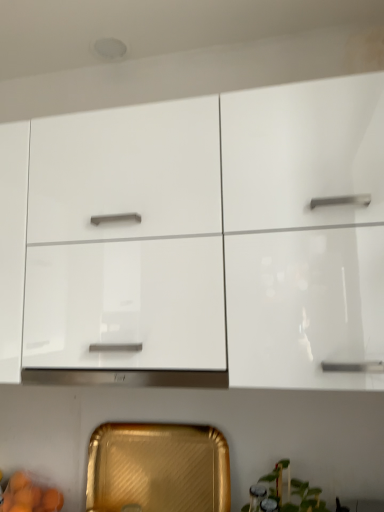
Question: From a real-world perspective, is gold textured tray at lower center, which is the first cabinetry in bottom-to-top order, beneath white glossy cabinet at upper center, placed as the 2th cabinetry when sorted from bottom to top?

Choices:
 (A) no
 (B) yes

Answer: (B)

Question: Considering the relative sizes of gold textured tray at lower center, marked as the second cabinetry in a top-to-bottom arrangement, and white glossy cabinet at upper center, which ranks as the 1th cabinetry in top-to-bottom order, in the image provided, is gold textured tray at lower center, marked as the second cabinetry in a top-to-bottom arrangement, smaller than white glossy cabinet at upper center, which ranks as the 1th cabinetry in top-to-bottom order,?

Choices:
 (A) no
 (B) yes

Answer: (B)

Question: Can you confirm if gold textured tray at lower center, marked as the second cabinetry in a top-to-bottom arrangement, is shorter than white glossy cabinet at upper center, placed as the 2th cabinetry when sorted from bottom to top?

Choices:
 (A) yes
 (B) no

Answer: (A)

Question: From the image's perspective, is gold textured tray at lower center, marked as the second cabinetry in a top-to-bottom arrangement, located above white glossy cabinet at upper center, placed as the 2th cabinetry when sorted from bottom to top?

Choices:
 (A) no
 (B) yes

Answer: (A)

Question: Can you confirm if gold textured tray at lower center, marked as the second cabinetry in a top-to-bottom arrangement, is taller than white glossy cabinet at upper center, placed as the 2th cabinetry when sorted from bottom to top?

Choices:
 (A) yes
 (B) no

Answer: (B)

Question: From the image's perspective, is gold textured tray at lower center, marked as the second cabinetry in a top-to-bottom arrangement, above or below green glossy plant at lower right?

Choices:
 (A) above
 (B) below

Answer: (A)

Question: Is point (102, 425) closer or farther from the camera than point (291, 483)?

Choices:
 (A) closer
 (B) farther

Answer: (B)

Question: Considering their positions, is gold textured tray at lower center, which is the first cabinetry in bottom-to-top order, located in front of or behind green glossy plant at lower right?

Choices:
 (A) front
 (B) behind

Answer: (B)

Question: From a real-world perspective, is gold textured tray at lower center, marked as the second cabinetry in a top-to-bottom arrangement, above or below green glossy plant at lower right?

Choices:
 (A) above
 (B) below

Answer: (A)

Question: From their relative heights in the image, would you say green glossy plant at lower right is taller or shorter than white glossy cabinet at upper center, placed as the 2th cabinetry when sorted from bottom to top?

Choices:
 (A) tall
 (B) short

Answer: (B)

Question: Relative to white glossy cabinet at upper center, which ranks as the 1th cabinetry in top-to-bottom order, is green glossy plant at lower right in front or behind?

Choices:
 (A) front
 (B) behind

Answer: (B)

Question: From the image's perspective, relative to white glossy cabinet at upper center, which ranks as the 1th cabinetry in top-to-bottom order, is green glossy plant at lower right above or below?

Choices:
 (A) below
 (B) above

Answer: (A)

Question: Visually, is green glossy plant at lower right positioned to the left or to the right of white glossy cabinet at upper center, placed as the 2th cabinetry when sorted from bottom to top?

Choices:
 (A) right
 (B) left

Answer: (A)

Question: From the image's perspective, is white glossy cabinet at upper center, which ranks as the 1th cabinetry in top-to-bottom order, located above or below gold textured tray at lower center, which is the first cabinetry in bottom-to-top order?

Choices:
 (A) above
 (B) below

Answer: (A)

Question: Does point (39, 167) appear closer or farther from the camera than point (130, 444)?

Choices:
 (A) farther
 (B) closer

Answer: (B)